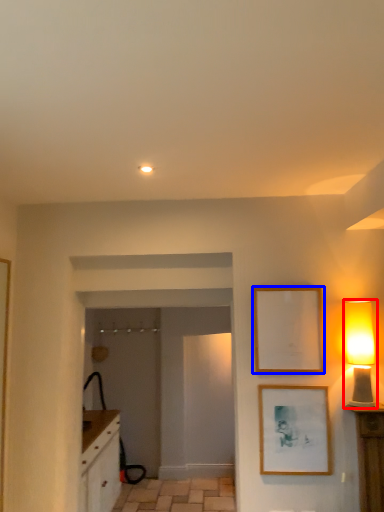
Question: Which object is closer to the camera taking this photo, table lamp (highlighted by a red box) or picture frame (highlighted by a blue box)?

Choices:
 (A) table lamp
 (B) picture frame

Answer: (A)